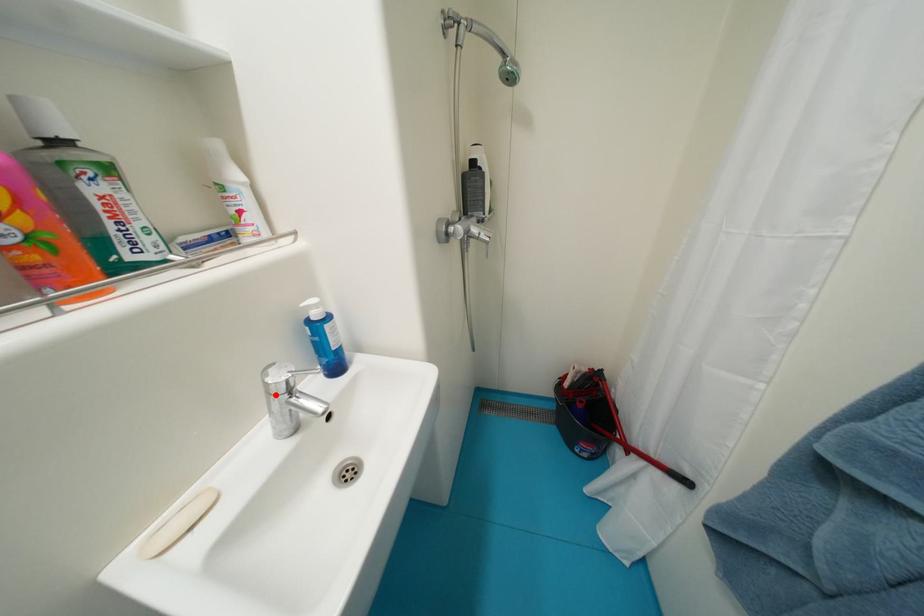
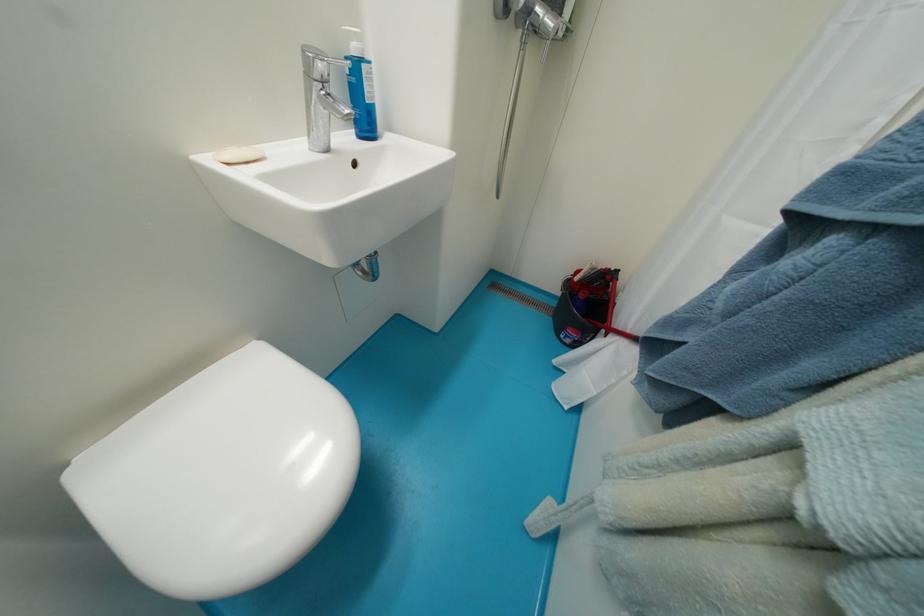
In the second image, find the point that corresponds to the highlighted location in the first image.

(313, 78)